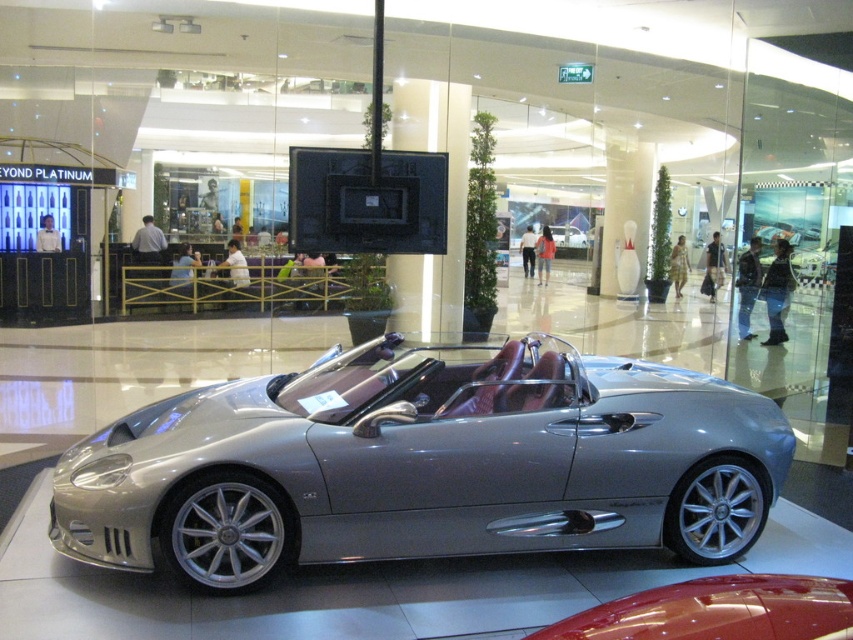
Question: Which point appears farthest from the camera in this image?

Choices:
 (A) (816, 579)
 (B) (583, 381)

Answer: (B)

Question: Which object appears farthest from the camera in this image?

Choices:
 (A) silver metallic convertible at center
 (B) glossy red car at lower right

Answer: (A)

Question: Does silver metallic convertible at center appear on the right side of glossy red car at lower right?

Choices:
 (A) no
 (B) yes

Answer: (A)

Question: Which point is farther to the camera?

Choices:
 (A) (637, 609)
 (B) (509, 419)

Answer: (B)

Question: Does silver metallic convertible at center appear on the left side of glossy red car at lower right?

Choices:
 (A) no
 (B) yes

Answer: (B)

Question: Does silver metallic convertible at center come in front of glossy red car at lower right?

Choices:
 (A) yes
 (B) no

Answer: (B)